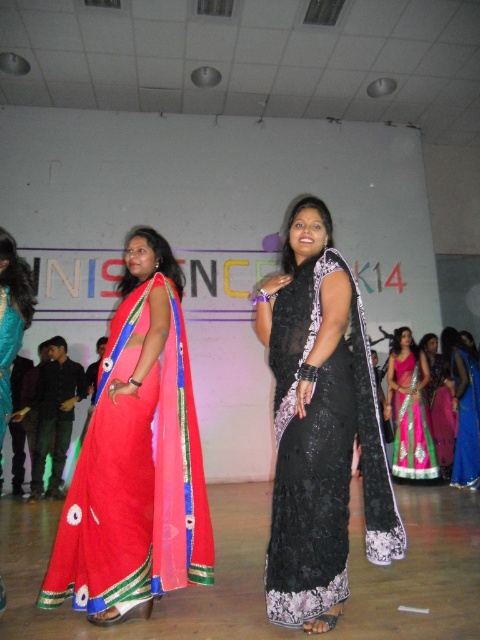
This screenshot has height=640, width=480. In order to click on shiny teal saree at left in this screenshot , I will do tap(12, 316).

Between point (23, 323) and point (462, 396), which one is positioned behind?

The point (462, 396) is more distant.

This screenshot has height=640, width=480. Identify the location of shiny teal saree at left. (12, 316).

What do you see at coordinates (464, 410) in the screenshot?
I see `shiny blue saree at right` at bounding box center [464, 410].

Which of these two, shiny blue saree at right or black lace saree at center, stands taller?

shiny blue saree at right

Where is `shiny blue saree at right`? The image size is (480, 640). shiny blue saree at right is located at coordinates (464, 410).

Identify the location of shiny blue saree at right. (464, 410).

Can you confirm if shiny teal saree at left is positioned to the right of black lace saree at center?

No, shiny teal saree at left is not to the right of black lace saree at center.

Does shiny teal saree at left have a smaller size compared to black lace saree at center?

Indeed, shiny teal saree at left has a smaller size compared to black lace saree at center.

Who is more distant from viewer, (x=0, y=296) or (x=446, y=412)?

The point (x=446, y=412) is more distant.

The image size is (480, 640). I want to click on shiny teal saree at left, so click(x=12, y=316).